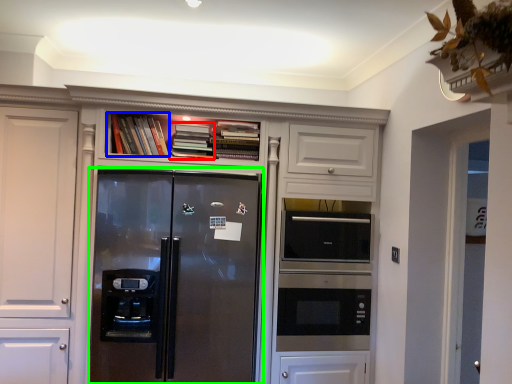
Question: Estimate the real-world distances between objects in this image. Which object is farther from book (highlighted by a red box), book (highlighted by a blue box) or refrigerator (highlighted by a green box)?

Choices:
 (A) book
 (B) refrigerator

Answer: (B)